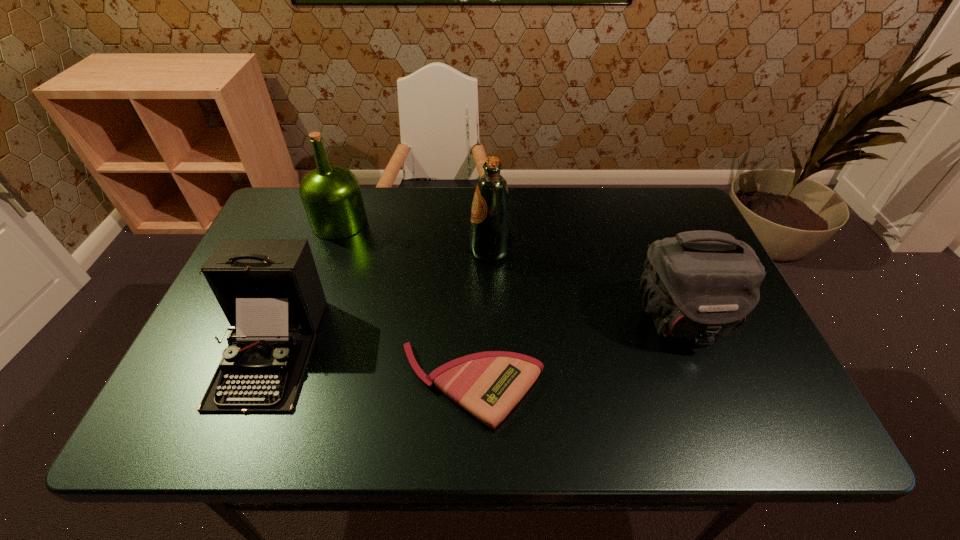
Identify the location of vacant area at the left edge. This screenshot has height=540, width=960. (285, 238).

This screenshot has width=960, height=540. Find the location of `free space at the right edge of the desktop`. free space at the right edge of the desktop is located at coordinates (710, 349).

Identify the location of free space between the right olive oil and the wristlet. (481, 318).

I want to click on free spot between the right olive oil and the left olive oil, so click(415, 236).

Where is `vacant area that lies between the shoulder bag and the right olive oil`? vacant area that lies between the shoulder bag and the right olive oil is located at coordinates (586, 285).

The image size is (960, 540). I want to click on vacant region between the left olive oil and the rightmost object, so click(x=510, y=271).

This screenshot has height=540, width=960. Identify the location of vacant area that lies between the right olive oil and the left olive oil. coord(415,236).

Where is `empty space that is in between the shoulder bag and the left olive oil`? This screenshot has width=960, height=540. empty space that is in between the shoulder bag and the left olive oil is located at coordinates (510, 271).

At what (x,y) coordinates should I click in order to perform the action: click on vacant space that is in between the rightmost object and the right olive oil. Please return your answer as a coordinate pair (x, y). Image resolution: width=960 pixels, height=540 pixels. Looking at the image, I should click on (586, 285).

The height and width of the screenshot is (540, 960). Find the location of `free space between the rightmost object and the right olive oil`. free space between the rightmost object and the right olive oil is located at coordinates (586, 285).